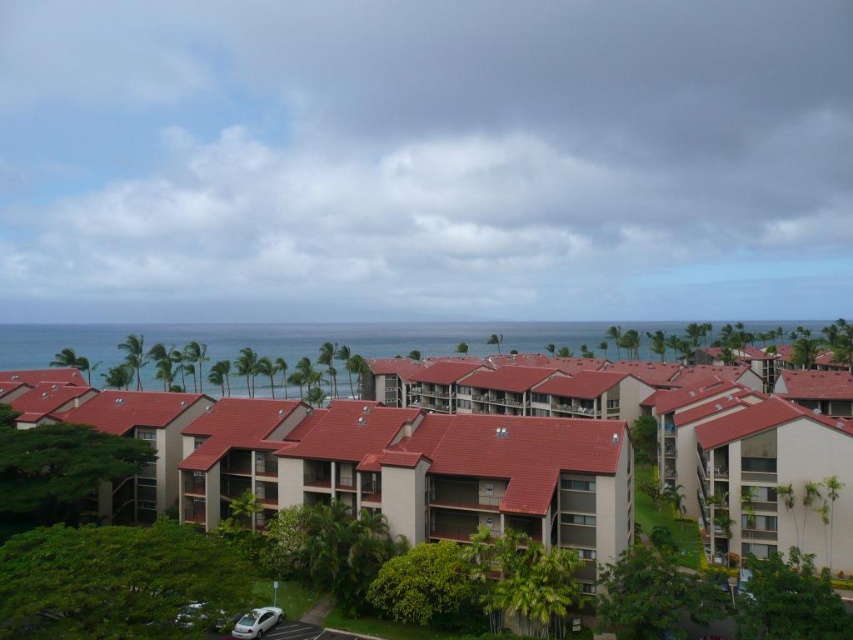
Question: Is the position of brown textured building at center more distant than that of white matte car at lower left?

Choices:
 (A) no
 (B) yes

Answer: (B)

Question: Observing the image, what is the correct spatial positioning of white matte car at lower left in reference to white matte car at lower center?

Choices:
 (A) left
 (B) right

Answer: (B)

Question: Which point is farther from the camera taking this photo?

Choices:
 (A) (181, 625)
 (B) (759, 445)

Answer: (B)

Question: Can you confirm if white matte car at lower left is bigger than white matte car at lower center?

Choices:
 (A) no
 (B) yes

Answer: (B)

Question: Among these objects, which one is nearest to the camera?

Choices:
 (A) white matte car at lower left
 (B) white matte car at lower center

Answer: (B)

Question: Which is farther from the white matte car at lower left?

Choices:
 (A) white matte car at lower center
 (B) brown textured building at center

Answer: (B)